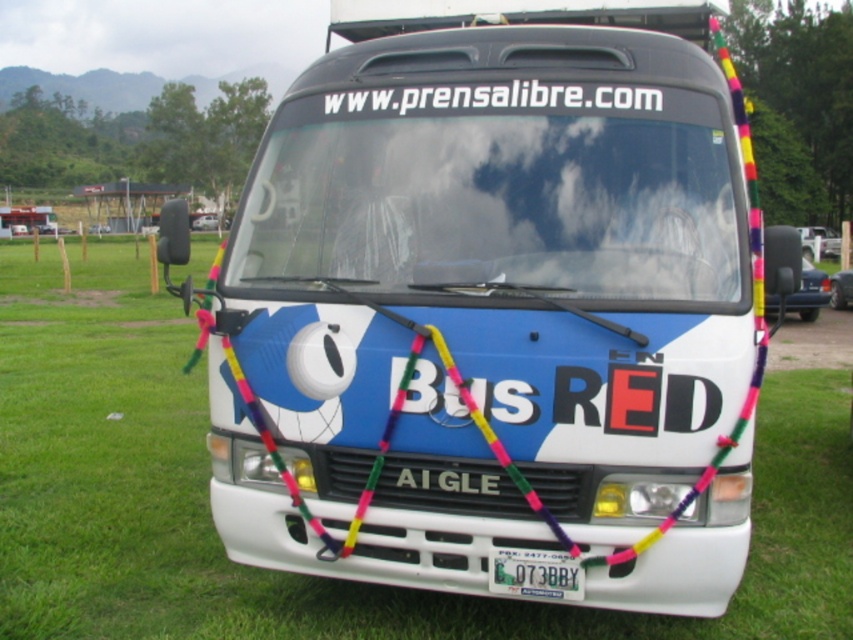
Question: Which point is farther to the camera?

Choices:
 (A) (498, 84)
 (B) (16, 486)
 (C) (552, 579)

Answer: (B)

Question: Is green grass at center wider than white matte text at center?

Choices:
 (A) yes
 (B) no

Answer: (A)

Question: Observing the image, what is the correct spatial positioning of white matte text at center in reference to green metallic license plate at center?

Choices:
 (A) below
 (B) above

Answer: (B)

Question: Considering the relative positions of green grass at center and green metallic license plate at center in the image provided, where is green grass at center located with respect to green metallic license plate at center?

Choices:
 (A) right
 (B) left

Answer: (B)

Question: Which of the following is the closest to the observer?

Choices:
 (A) (567, 598)
 (B) (354, 109)

Answer: (A)

Question: Which point is farther from the camera taking this photo?

Choices:
 (A) (820, 531)
 (B) (490, 100)

Answer: (A)